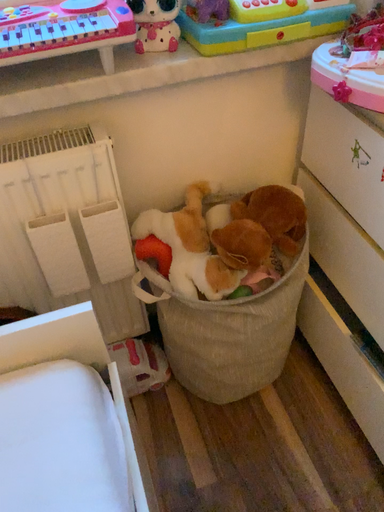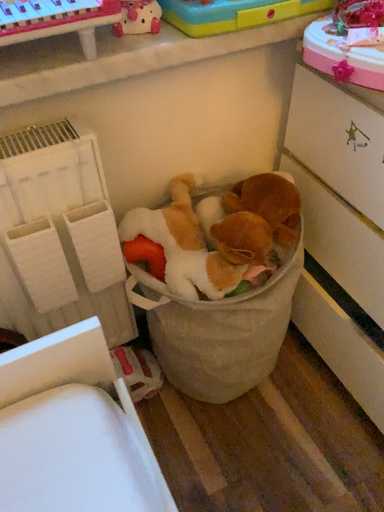
Question: How did the camera likely rotate when shooting the video?

Choices:
 (A) rotated right
 (B) rotated left

Answer: (A)